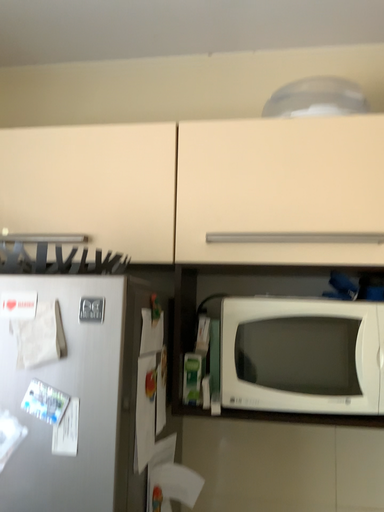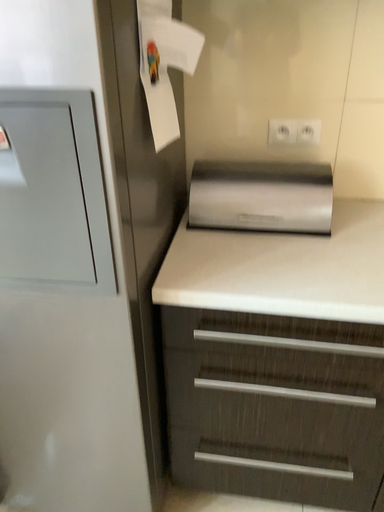
Question: Which way did the camera rotate in the video?

Choices:
 (A) rotated downward
 (B) rotated upward

Answer: (A)